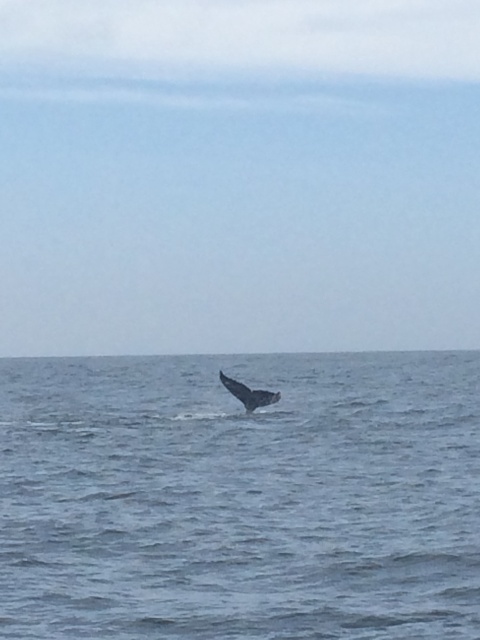
Question: Is blue water at center below gray matte whale at center?

Choices:
 (A) no
 (B) yes

Answer: (B)

Question: Does blue water at center have a lesser width compared to gray matte whale at center?

Choices:
 (A) no
 (B) yes

Answer: (A)

Question: Which of the following is the farthest from the observer?

Choices:
 (A) (264, 404)
 (B) (160, 492)

Answer: (A)

Question: Observing the image, what is the correct spatial positioning of blue water at center in reference to gray matte whale at center?

Choices:
 (A) below
 (B) above

Answer: (A)